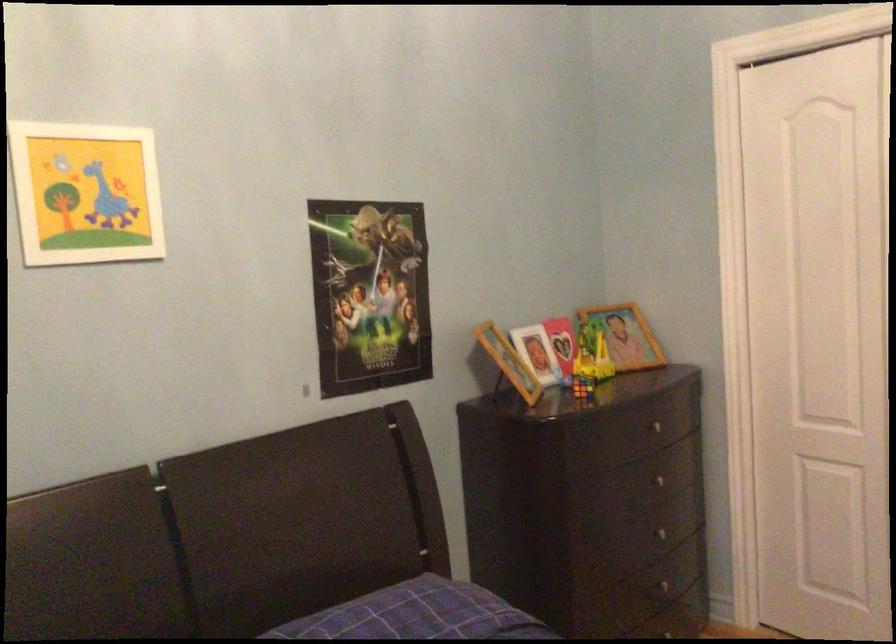
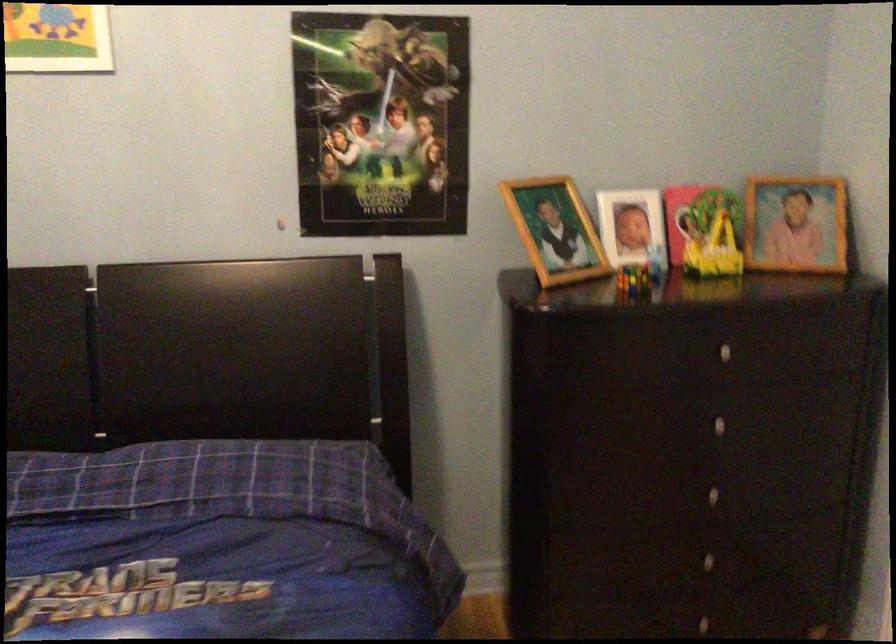
The point at (600, 354) is marked in the first image. Where is the corresponding point in the second image?

(719, 240)